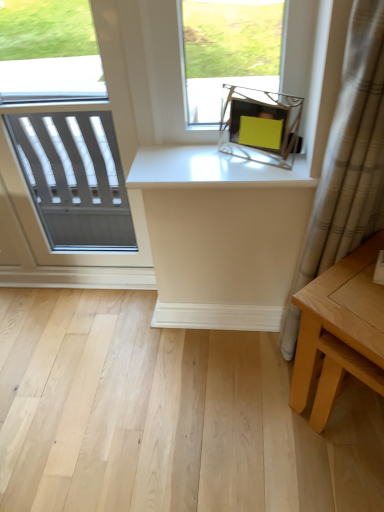
The width and height of the screenshot is (384, 512). In order to click on free space above white glossy counter top at upper center (from a real-world perspective) in this screenshot , I will do `click(221, 156)`.